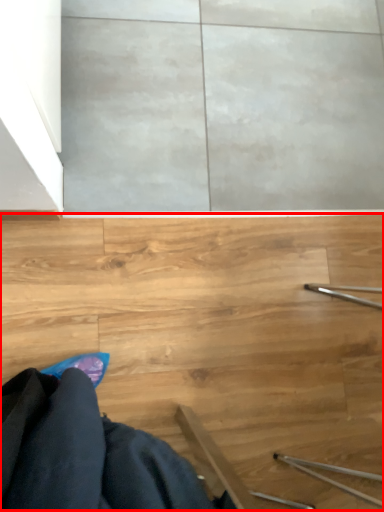
Question: From the image's perspective, where is stairs (annotated by the red box) located in relation to robe in the image?

Choices:
 (A) below
 (B) above

Answer: (B)